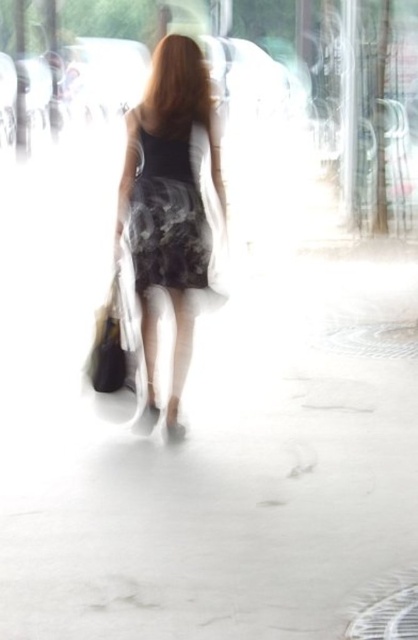
Question: In this image, where is floral dress at center located relative to blonde silky hair at upper center?

Choices:
 (A) above
 (B) below

Answer: (B)

Question: Which object is closer to the camera taking this photo?

Choices:
 (A) floral-patterned fabric dress at center
 (B) floral dress at center
 (C) blonde silky hair at upper center

Answer: (B)

Question: Which point is closer to the camera?

Choices:
 (A) (175, 360)
 (B) (162, 45)

Answer: (B)

Question: Which point is closer to the camera taking this photo?

Choices:
 (A) (201, 236)
 (B) (153, 141)
 (C) (203, 65)

Answer: (B)

Question: Does floral-patterned fabric dress at center appear under blonde silky hair at upper center?

Choices:
 (A) no
 (B) yes

Answer: (B)

Question: Does floral dress at center have a smaller size compared to floral-patterned fabric dress at center?

Choices:
 (A) no
 (B) yes

Answer: (A)